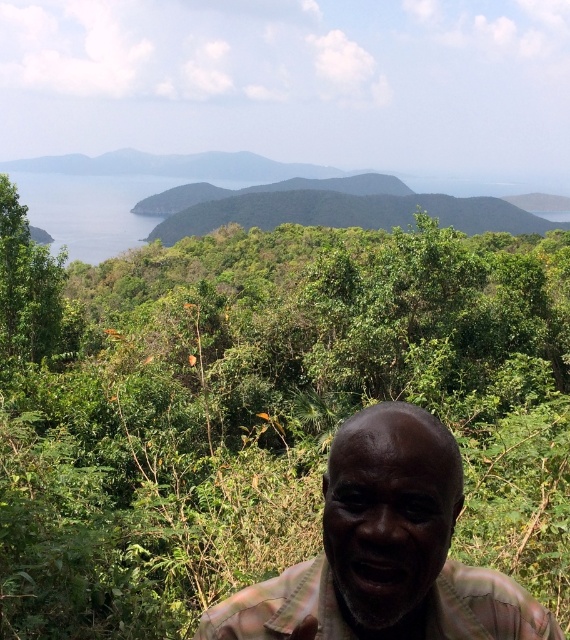
Question: Does green leafy jungle at center appear on the right side of plaid fabric face at center?

Choices:
 (A) yes
 (B) no

Answer: (B)

Question: Which point is closer to the camera taking this photo?

Choices:
 (A) (553, 532)
 (B) (478, 618)

Answer: (B)

Question: Can you confirm if green leafy jungle at center is thinner than plaid fabric face at center?

Choices:
 (A) no
 (B) yes

Answer: (A)

Question: Which of the following is the closest to the observer?

Choices:
 (A) (105, 451)
 (B) (368, 604)

Answer: (B)

Question: Can you confirm if green leafy jungle at center is positioned to the left of plaid fabric face at center?

Choices:
 (A) no
 (B) yes

Answer: (B)

Question: Which of the following is the farthest from the observer?

Choices:
 (A) (374, 364)
 (B) (238, 632)

Answer: (A)